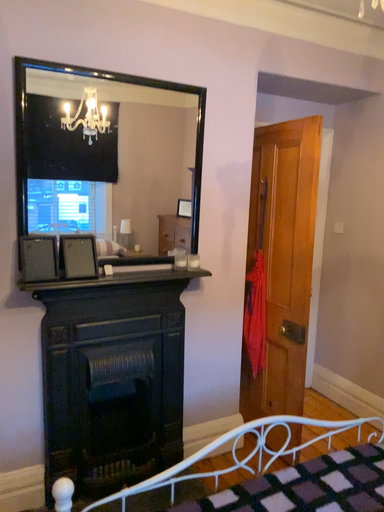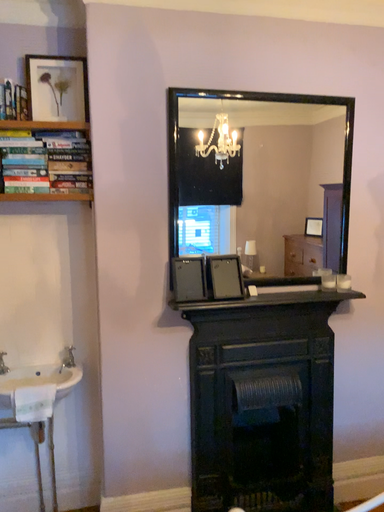
Question: How did the camera likely rotate when shooting the video?

Choices:
 (A) rotated left
 (B) rotated right

Answer: (A)